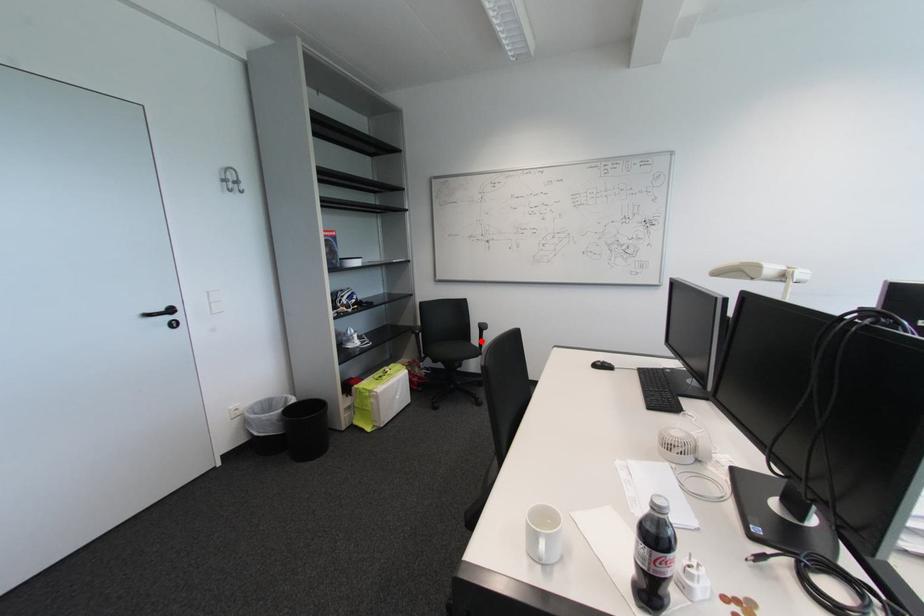
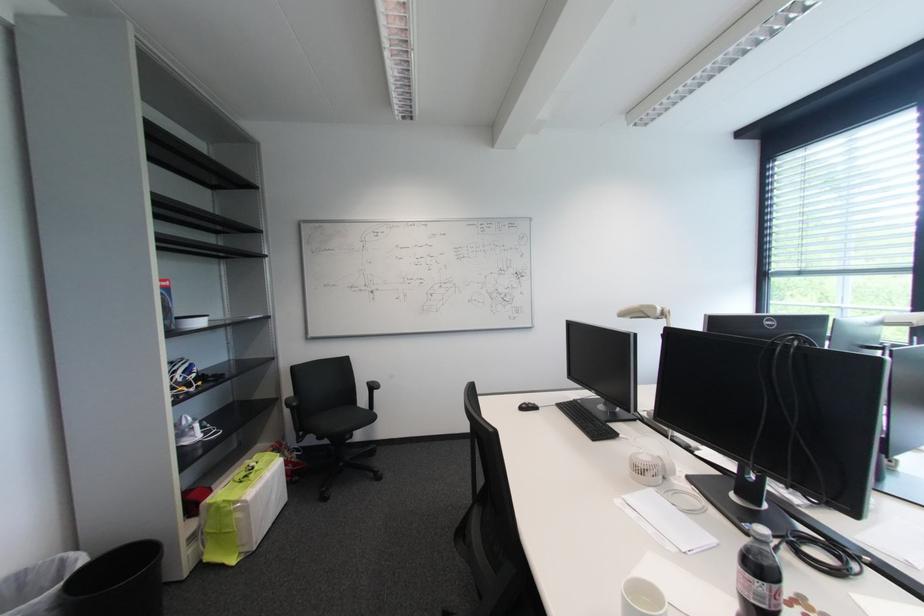
Find the pixel in the second image that matches the highlighted location in the first image.

(369, 403)